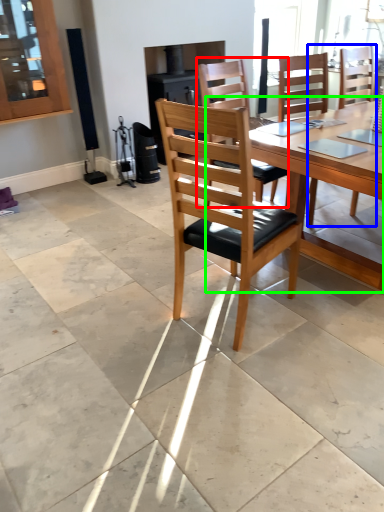
Question: Considering the real-world distances, which object is farthest from chair (highlighted by a red box)? chair (highlighted by a blue box) or round table (highlighted by a green box)?

Choices:
 (A) chair
 (B) round table

Answer: (A)